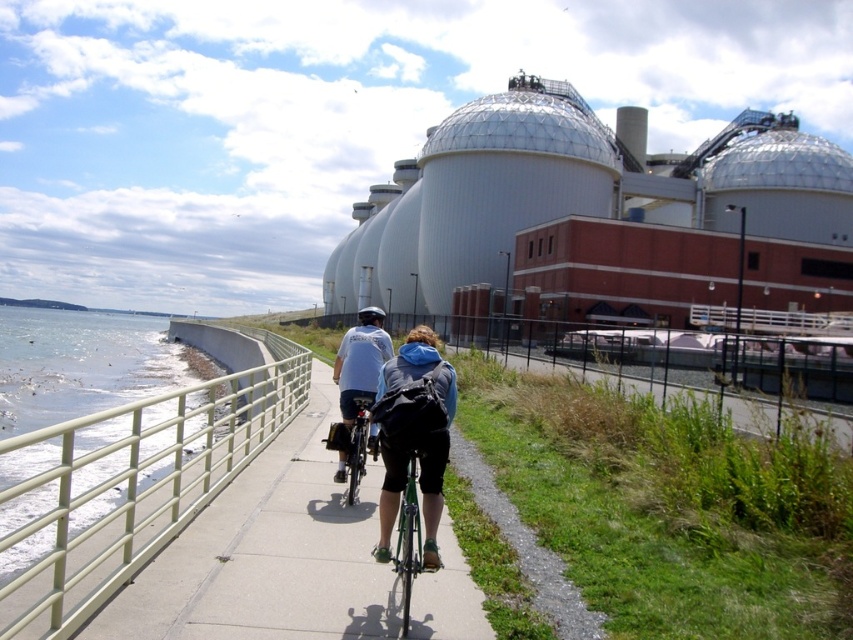
You are a photographer trying to capture a wide shot of the green matte bicycle at center without including the green matte railing at lower left in the frame. Based on their widths, is this possible?

The green matte railing at lower left might be wider than green matte bicycle at center, so there is a possibility that the railing could block the bicycle if not positioned carefully. However, without exact measurements, it is uncertain if the bicycle will fit entirely within the frame without the railing.

You are standing at the starting point of the coastal path and see two cyclists ahead. The first cyclist is at point (80, 468) and the second cyclist is at point (358, 316). Which cyclist is closer to you?

The cyclist at point (80, 468) is closer because it is in front of the cyclist at point (358, 316).